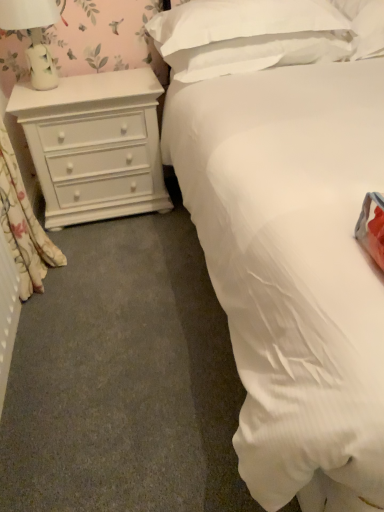
Question: Which direction should I rotate to face white soft pillow at upper center, marked as the 2th pillow in a right-to-left arrangement, — up or down?

Choices:
 (A) up
 (B) down

Answer: (A)

Question: Considering the relative sizes of white matte chest of drawers at left and floral fabric curtain at left in the image provided, is white matte chest of drawers at left taller than floral fabric curtain at left?

Choices:
 (A) no
 (B) yes

Answer: (A)

Question: Are white matte chest of drawers at left and floral fabric curtain at left far apart?

Choices:
 (A) no
 (B) yes

Answer: (A)

Question: Considering the relative sizes of white matte chest of drawers at left and floral fabric curtain at left in the image provided, is white matte chest of drawers at left shorter than floral fabric curtain at left?

Choices:
 (A) yes
 (B) no

Answer: (A)

Question: Is white matte chest of drawers at left thinner than floral fabric curtain at left?

Choices:
 (A) yes
 (B) no

Answer: (B)

Question: From a real-world perspective, is white matte chest of drawers at left positioned over floral fabric curtain at left based on gravity?

Choices:
 (A) yes
 (B) no

Answer: (B)

Question: From a real-world perspective, is white matte chest of drawers at left positioned under floral fabric curtain at left based on gravity?

Choices:
 (A) yes
 (B) no

Answer: (A)

Question: Is white soft pillow at upper center, the first pillow from the right, turned away from white soft pillow at upper center, marked as the 2th pillow in a right-to-left arrangement?

Choices:
 (A) yes
 (B) no

Answer: (B)

Question: From a real-world perspective, is white soft pillow at upper center, acting as the 2th pillow starting from the left, on top of white soft pillow at upper center, positioned as the first pillow in left-to-right order?

Choices:
 (A) yes
 (B) no

Answer: (B)

Question: Is white soft pillow at upper center, the first pillow from the right, at the left side of white soft pillow at upper center, marked as the 2th pillow in a right-to-left arrangement?

Choices:
 (A) yes
 (B) no

Answer: (B)

Question: Is white soft pillow at upper center, acting as the 2th pillow starting from the left, to the right of white soft pillow at upper center, marked as the 2th pillow in a right-to-left arrangement, from the viewer's perspective?

Choices:
 (A) yes
 (B) no

Answer: (A)

Question: Considering the relative sizes of white soft pillow at upper center, the first pillow from the right, and white soft pillow at upper center, positioned as the first pillow in left-to-right order, in the image provided, is white soft pillow at upper center, the first pillow from the right, smaller than white soft pillow at upper center, positioned as the first pillow in left-to-right order,?

Choices:
 (A) yes
 (B) no

Answer: (A)

Question: From the image's perspective, is white soft pillow at upper center, acting as the 2th pillow starting from the left, below white soft pillow at upper center, positioned as the first pillow in left-to-right order?

Choices:
 (A) no
 (B) yes

Answer: (A)

Question: Are white matte chest of drawers at left and white soft pillow at upper center, acting as the 2th pillow starting from the left, located far from each other?

Choices:
 (A) yes
 (B) no

Answer: (A)